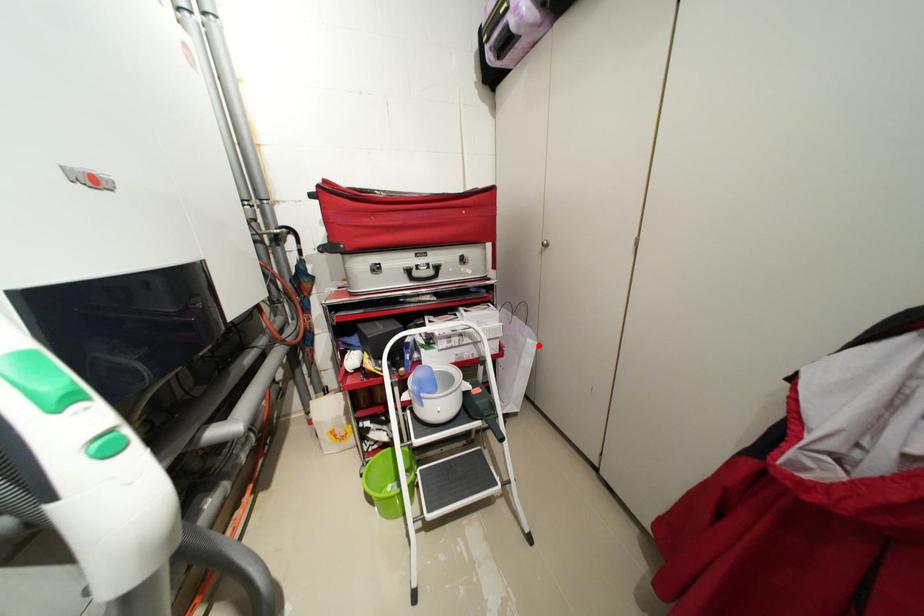
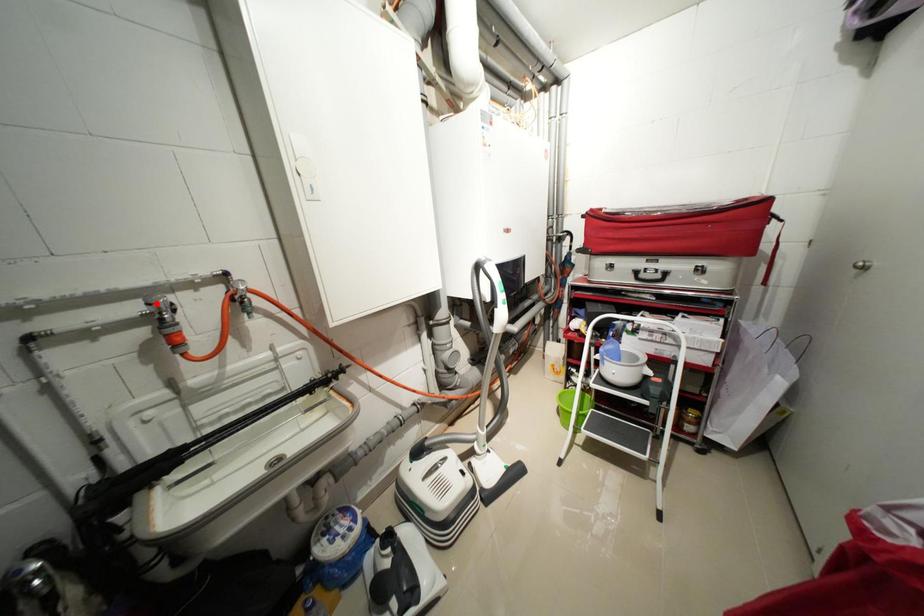
I am providing you with two images of the same scene from different viewpoints. A red point is marked on the first image and another point is marked on the second image. Is the red point in image1 aligned with the point shown in image2?

No